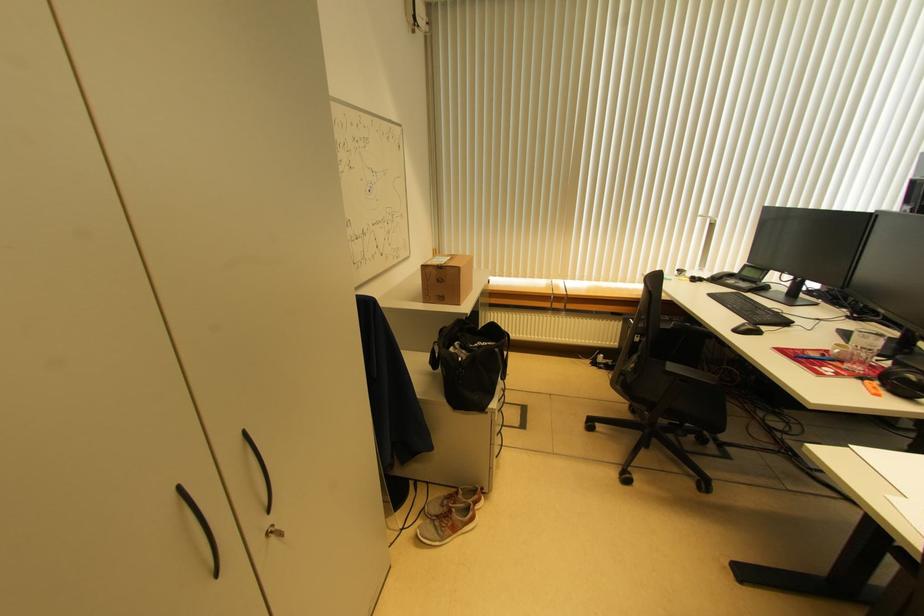
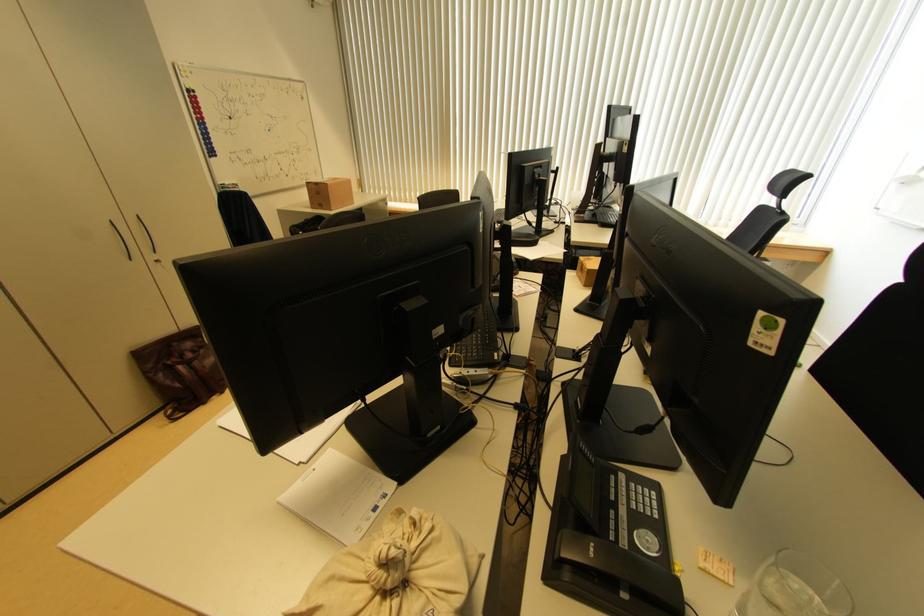
Locate, in the second image, the point that corresponds to [459,272] in the first image.

(329, 188)